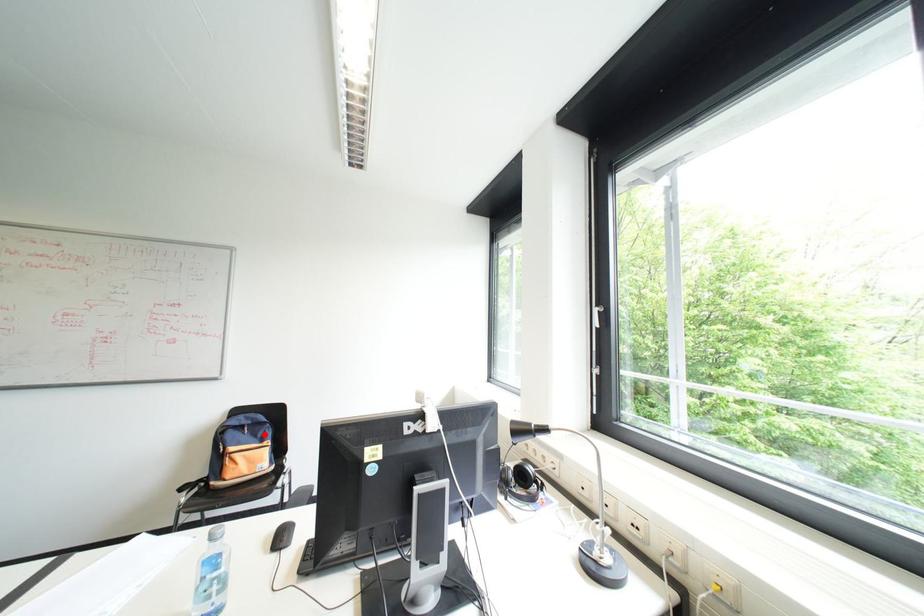
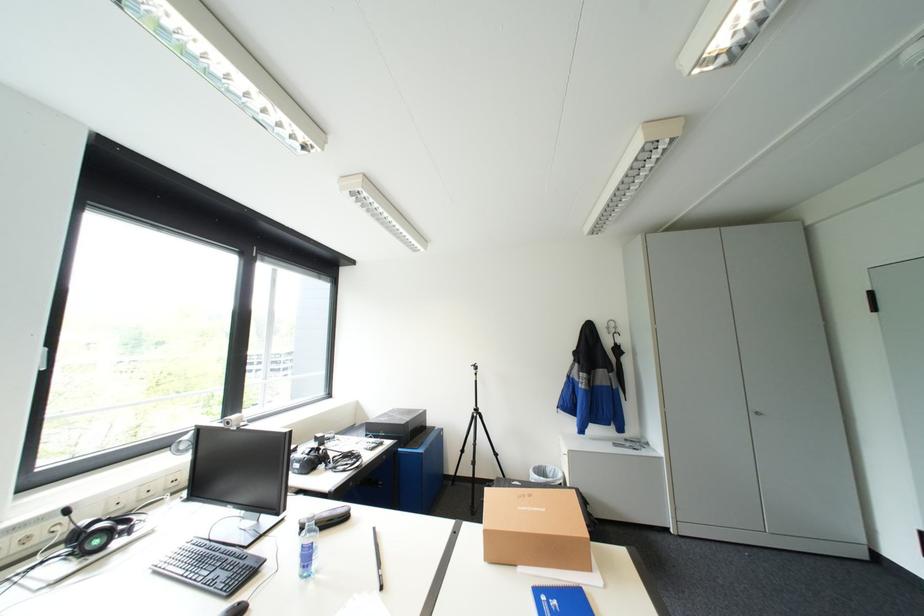
Question: I am providing you with two images of the same scene from different viewpoints. A red point is marked on the first image. Can you still see the location of the red point in image 2?

Choices:
 (A) Yes
 (B) No

Answer: (B)